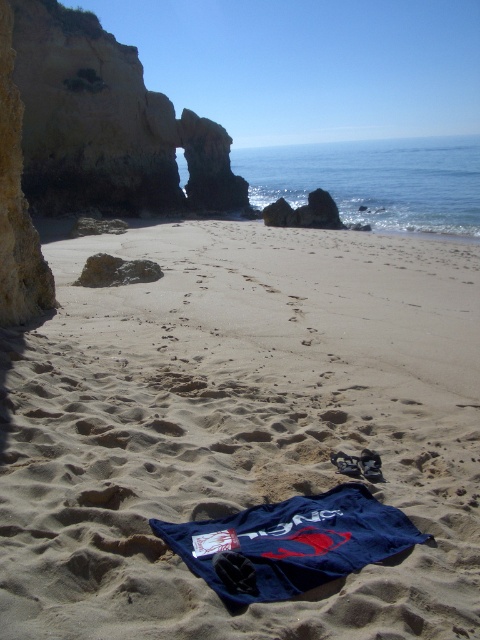
Is sandy textured towel at center to the right of brown rocky arch at upper left from the viewer's perspective?

Indeed, sandy textured towel at center is positioned on the right side of brown rocky arch at upper left.

Between sandy textured towel at center and brown rocky arch at upper left, which one has more height?

brown rocky arch at upper left

The height and width of the screenshot is (640, 480). Identify the location of sandy textured towel at center. (240, 428).